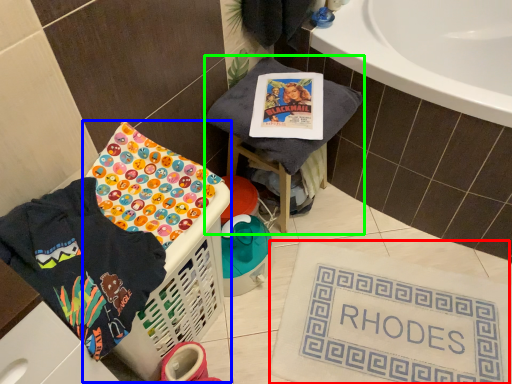
Question: Estimate the real-world distances between objects in this image. Which object is closer to bath mat (highlighted by a red box), basket container (highlighted by a blue box) or furniture (highlighted by a green box)?

Choices:
 (A) basket container
 (B) furniture

Answer: (A)